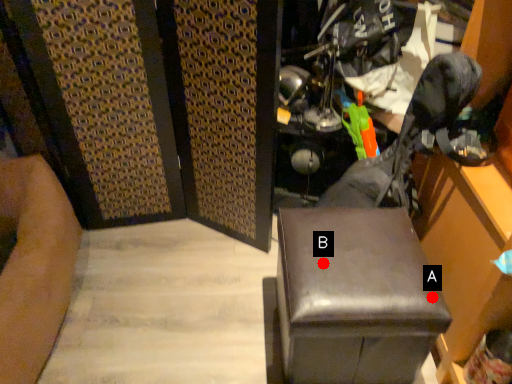
Question: Two points are circled on the image, labeled by A and B beside each circle. Which point appears farthest from the camera in this image?

Choices:
 (A) A is further
 (B) B is further

Answer: (B)